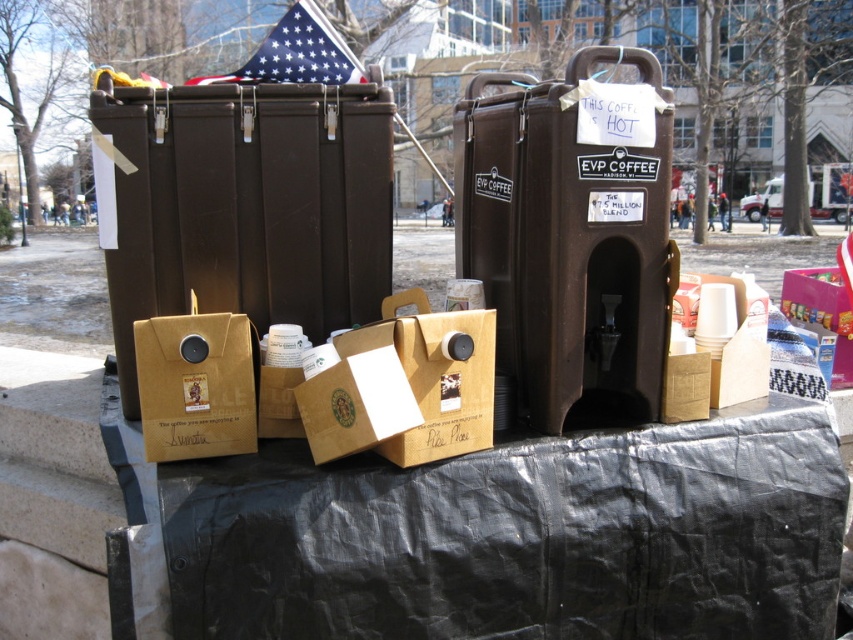
You are setting up a coffee station and need to place the matte brown cardboard box at center and the brown paper bag at center. Based on the scene description, where should you position the matte brown cardboard box relative to the brown paper bag?

The matte brown cardboard box at center should be placed above the brown paper bag at center as per the description.

You are setting up a coffee station and need to stack items. You have a matte brown cardboard box at center and a brown paper bag at center. Which item can be placed on top without collapsing the lower one?

The brown paper bag at center should be placed on top of the matte brown cardboard box at center since the matte brown cardboard box at center has a greater height and is likely sturdier to support the weight.

You are setting up a coffee station and need to place both the matte brown cardboard box at center and the brown paper bag at center on a shelf. If the shelf has a width of 30 cm, can both items fit side by side?

The matte brown cardboard box at center might be wider than brown paper bag at center, so it is uncertain if both will fit on a 30 cm shelf without overlapping. Measure their combined width to confirm.